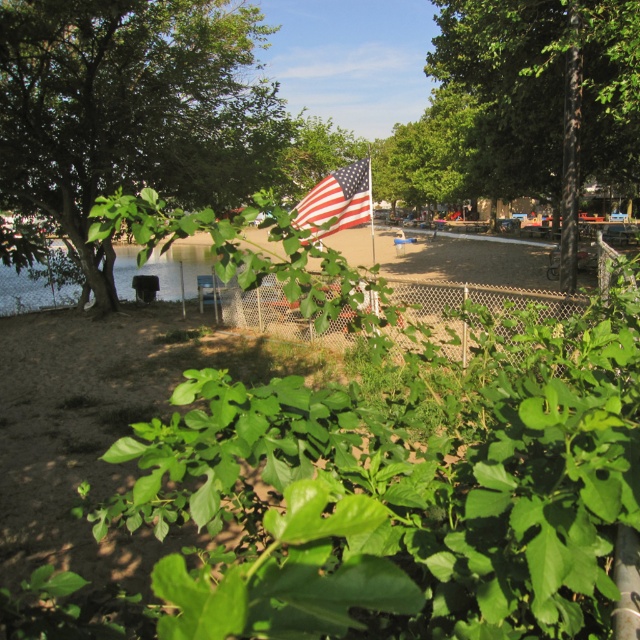
You are standing at the point with coordinates point (45, 298) and want to walk towards the point (445, 56). Will the dense cluster of green leaves in the foreground block your path?

Point (445, 56) is in front of point (45, 298), so the dense cluster of green leaves in the foreground will block your path.

You are a gardener who needs to prune trees to ensure sunlight reaches the lower plants. Given the green leafy tree at left and the green leafy tree at center, which tree should you prune first to allow more sunlight to the lower plants?

The green leafy tree at left has a greater height compared to the green leafy tree at center, so pruning the taller green leafy tree at left first would allow more sunlight to reach the lower plants.